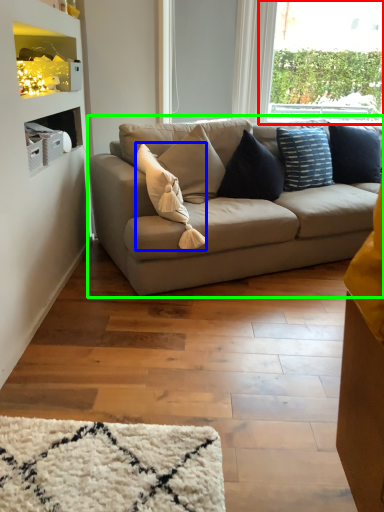
Question: Estimate the real-world distances between objects in this image. Which object is farther from window (highlighted by a red box), pillow (highlighted by a blue box) or studio couch (highlighted by a green box)?

Choices:
 (A) pillow
 (B) studio couch

Answer: (A)